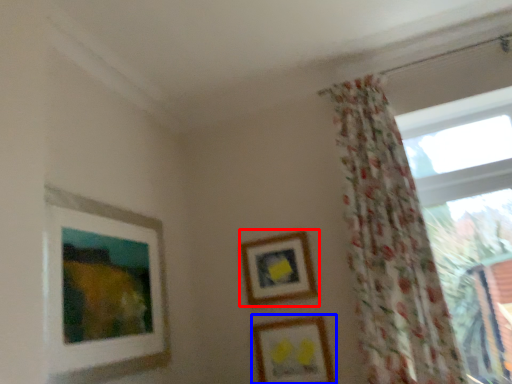
Question: Which of the following is the closest to the observer, picture frame (highlighted by a red box) or picture frame (highlighted by a blue box)?

Choices:
 (A) picture frame
 (B) picture frame

Answer: (B)